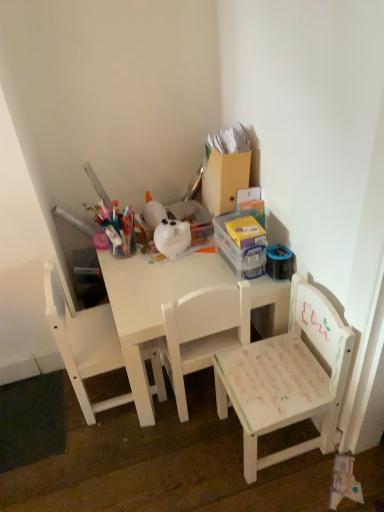
Where is `free spot above white matte table at center (from a real-world perspective)`? free spot above white matte table at center (from a real-world perspective) is located at coordinates (167, 265).